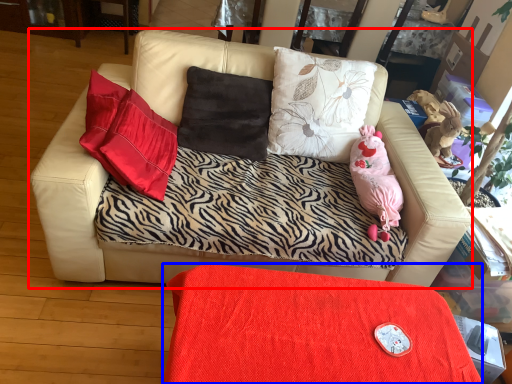
Question: Which object is further to the camera taking this photo, studio couch (highlighted by a red box) or table (highlighted by a blue box)?

Choices:
 (A) studio couch
 (B) table

Answer: (A)